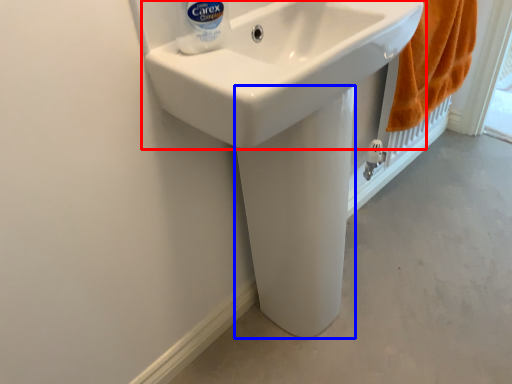
Question: Which of the following is the closest to the observer, sink (highlighted by a red box) or bidet (highlighted by a blue box)?

Choices:
 (A) sink
 (B) bidet

Answer: (A)